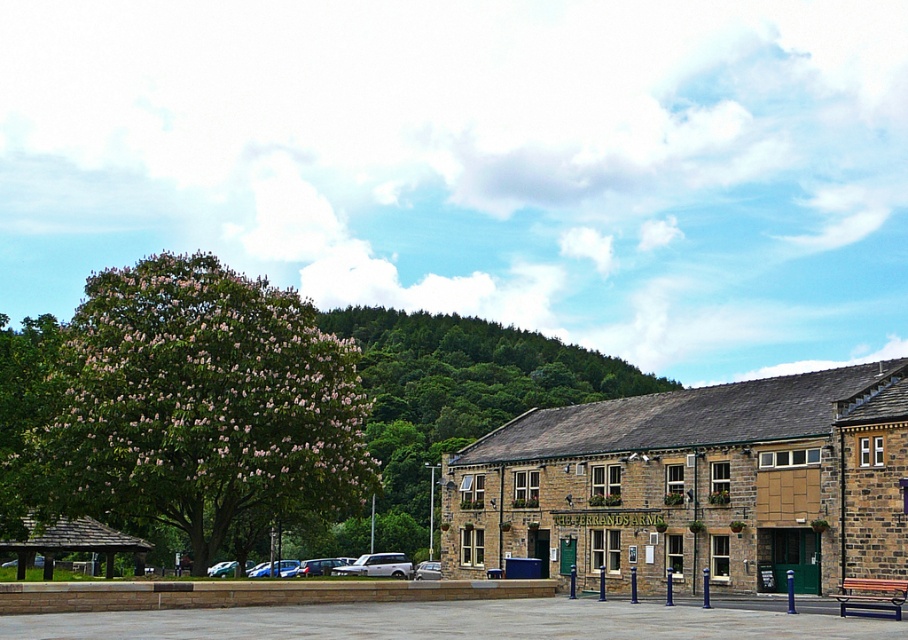
Can you confirm if green leafy tree at left is wider than metallic park bench at lower right?

Yes.

Does point (37, 404) lie behind point (886, 611)?

Yes, it is behind point (886, 611).

Which is behind, point (192, 326) or point (892, 605)?

The point (192, 326) is behind.

Identify the location of green leafy tree at left. (193, 404).

Is point (890, 595) farther from camera compared to point (372, 564)?

No, it is not.

Who is more distant from viewer, (876, 589) or (349, 572)?

The point (349, 572) is behind.

The image size is (908, 640). Identify the location of metallic park bench at lower right. (871, 596).

The width and height of the screenshot is (908, 640). In order to click on green leafy tree at left in this screenshot , I will do `click(193, 404)`.

Can you confirm if green leafy tree at left is positioned to the right of silver metallic van at center?

In fact, green leafy tree at left is to the left of silver metallic van at center.

Is point (102, 512) farther from camera compared to point (340, 572)?

No, it is in front of (340, 572).

This screenshot has width=908, height=640. What are the coordinates of `green leafy tree at left` in the screenshot? It's located at (193, 404).